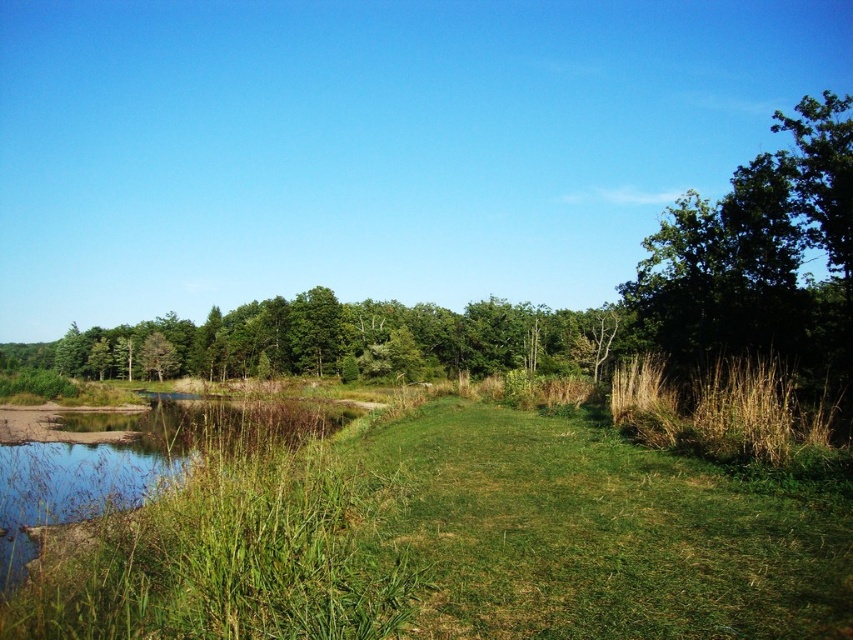
You are standing in the serene natural landscape described. You see a point marked at coordinates (759, 259). Based on the scene, what object does this point most likely represent?

The point at coordinates (759, 259) corresponds to the green leafy tree at upper right.

You are standing in the middle of the grassy area and want to take a photo of the brown grassy reed at right and the green leafy tree at upper right. Which object will appear closer to the camera in the photo?

The green leafy tree at upper right will appear closer to the camera because it is in front of the brown grassy reed at right.